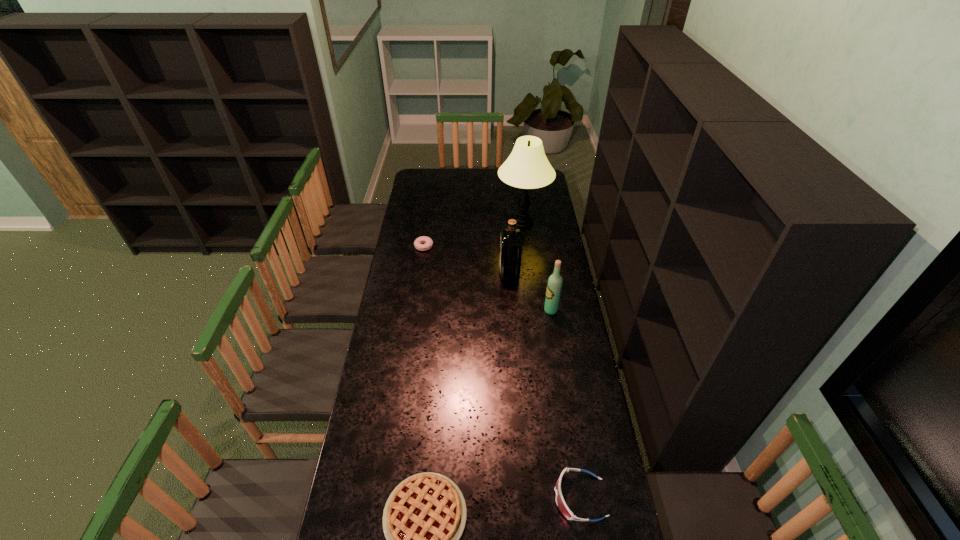
At what (x,y) coordinates should I click in order to perform the action: click on free space located on the front label of the liquor. Please return your answer as a coordinate pair (x, y). This screenshot has height=540, width=960. Looking at the image, I should click on (467, 273).

Locate an element on the screen. vacant point located 0.320m on the front-facing side of the wine bottle is located at coordinates (472, 310).

Find the location of a particular element. Image resolution: width=960 pixels, height=540 pixels. free space located 0.230m on the front-facing side of the wine bottle is located at coordinates (492, 310).

At what (x,y) coordinates should I click in order to perform the action: click on vacant space located 0.200m on the front-facing side of the wine bottle. Please return your answer as a coordinate pair (x, y). Looking at the image, I should click on (499, 310).

This screenshot has height=540, width=960. Identify the location of vacant space located on the front-facing side of the third shortest object. (471, 497).

Locate an element on the screen. vacant region located on the front-facing side of the third shortest object is located at coordinates (443, 497).

At what (x,y) coordinates should I click in order to perform the action: click on vacant region located 0.140m on the front-facing side of the third shortest object. Please return your answer as a coordinate pair (x, y). Looking at the image, I should click on (510, 497).

The width and height of the screenshot is (960, 540). Identify the location of free point located 0.400m on the right of the doughnut. (511, 246).

The image size is (960, 540). What are the coordinates of `object that is at the left edge` in the screenshot? It's located at (428, 241).

The height and width of the screenshot is (540, 960). I want to click on lamp that is at the right edge, so click(x=527, y=167).